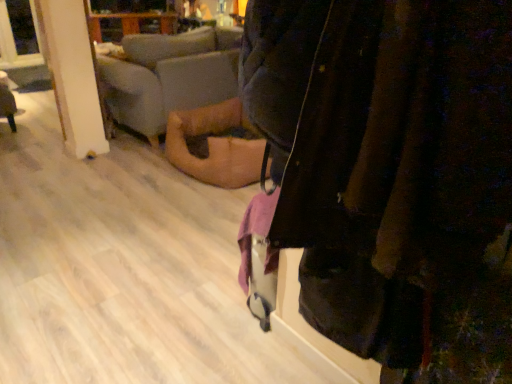
Question: In the image, is velvet dark jacket at center positioned in front of or behind wooden floor at lower left?

Choices:
 (A) front
 (B) behind

Answer: (A)

Question: Based on their positions, is velvet dark jacket at center located to the left or right of wooden floor at lower left?

Choices:
 (A) left
 (B) right

Answer: (B)

Question: Which object is positioned closest to the transparent glass window at upper left?

Choices:
 (A) velvet dark jacket at center
 (B) wooden floor at lower left
 (C) soft beige fabric couch at center

Answer: (B)

Question: Considering the real-world distances, which object is closest to the soft beige fabric couch at center?

Choices:
 (A) transparent glass window at upper left
 (B) wooden floor at lower left
 (C) velvet dark jacket at center

Answer: (A)